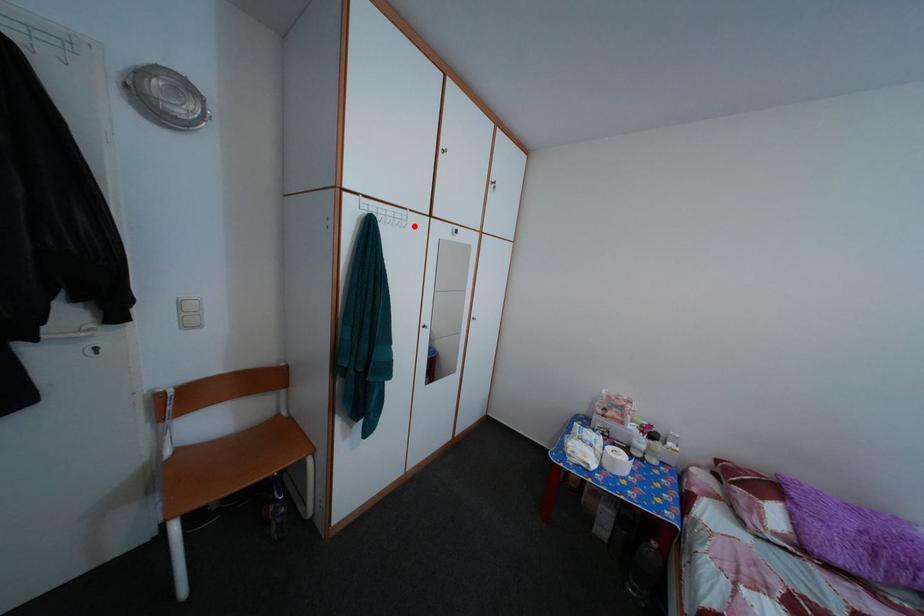
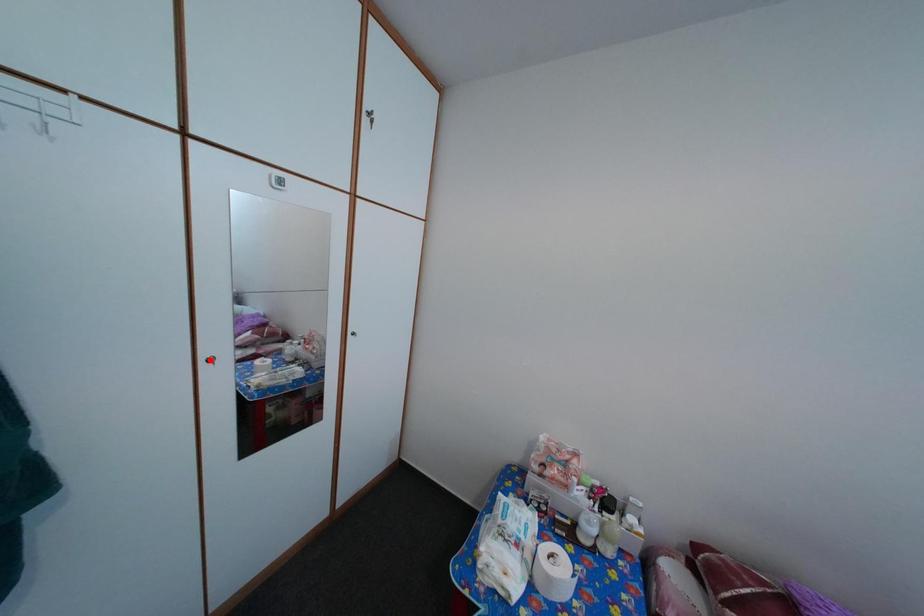
Based on the photo, I am providing you with two images of the same scene from different viewpoints. A red point is marked on the first image and another point is marked on the second image. Is the red point in image1 aligned with the point shown in image2?

No